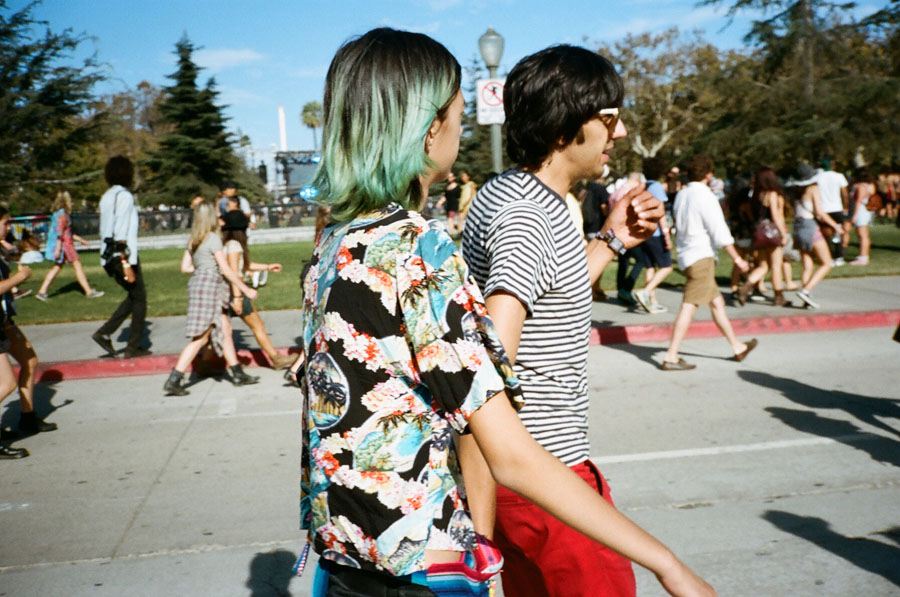
This screenshot has width=900, height=597. In order to click on stage in this screenshot , I will do `click(294, 179)`.